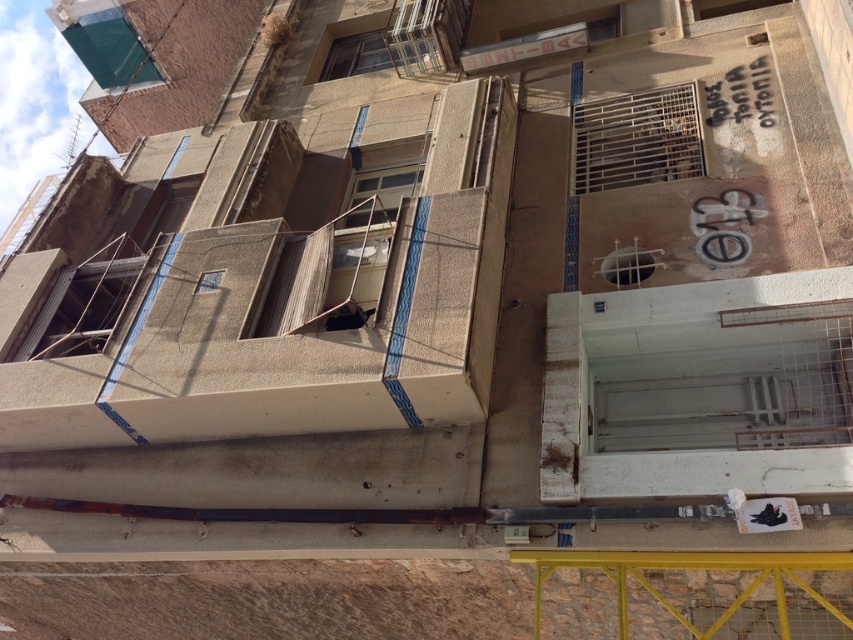
You are standing in front of the residential building and notice a point marked at coordinates (297, 308). What object is located at that point?

The point at coordinates (297, 308) is where the concrete textured balcony at center is located.

You are a painter hired to paint the two balconies, the concrete textured balcony at center and the white concrete balcony at lower right. You need to estimate the amount of paint required. Which balcony requires more paint due to its larger surface area?

The white concrete balcony at lower right requires more paint because it has a greater width than the concrete textured balcony at center, leading to a larger surface area.